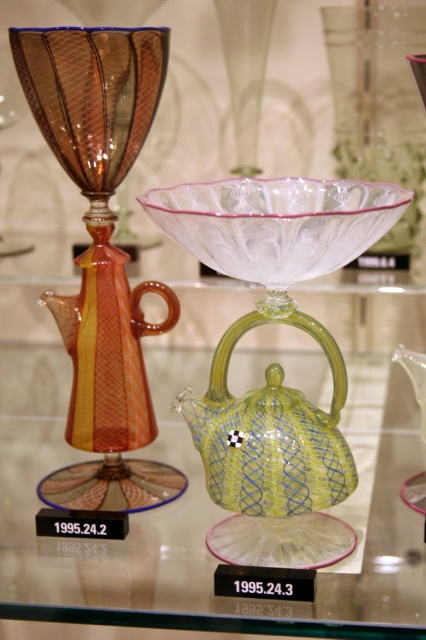
Who is taller, green textured glass teapot at center or transparent glass bowl at upper center?

Standing taller between the two is transparent glass bowl at upper center.

Is green textured glass teapot at center in front of transparent glass bowl at upper center?

That is True.

Who is more distant from viewer, [226,422] or [385,40]?

Point [385,40]

Image resolution: width=426 pixels, height=640 pixels. I want to click on green textured glass teapot at center, so click(x=273, y=458).

Between amber glass teapot at left and green textured glass teapot at center, which one has less height?

Standing shorter between the two is green textured glass teapot at center.

Which is below, amber glass teapot at left or green textured glass teapot at center?

green textured glass teapot at center

What are the coordinates of `amber glass teapot at left` in the screenshot? It's located at (101, 252).

Consider the image. Can you confirm if green textured teapot at center is positioned below green textured glass teapot at center?

Actually, green textured teapot at center is above green textured glass teapot at center.

Does green textured teapot at center appear over green textured glass teapot at center?

Correct, green textured teapot at center is located above green textured glass teapot at center.

Between point (207, 369) and point (339, 417), which one is positioned in front?

Point (339, 417) is more forward.

Find the location of a particular element. Image resolution: width=426 pixels, height=640 pixels. green textured teapot at center is located at coordinates (198, 490).